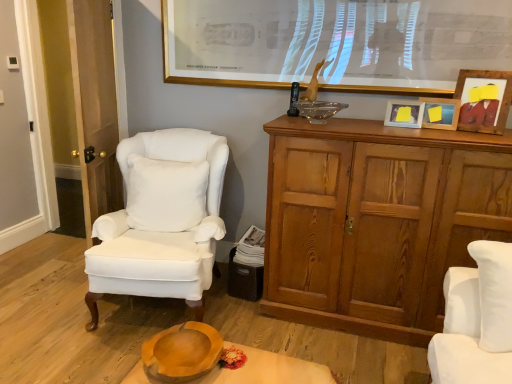
Identify the location of vacant space in front of white matte picture frame at upper right, which is the 2th picture frame in left-to-right order. (418, 128).